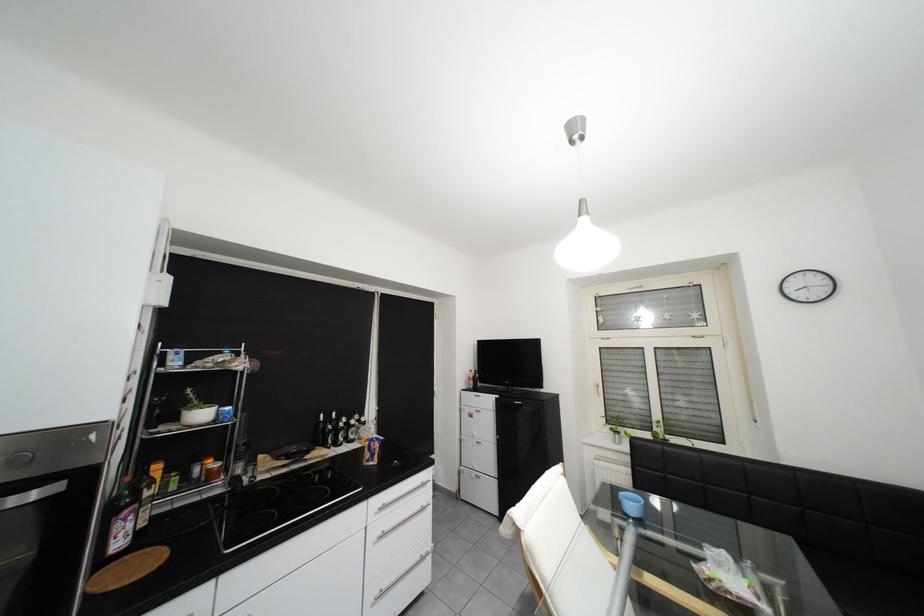
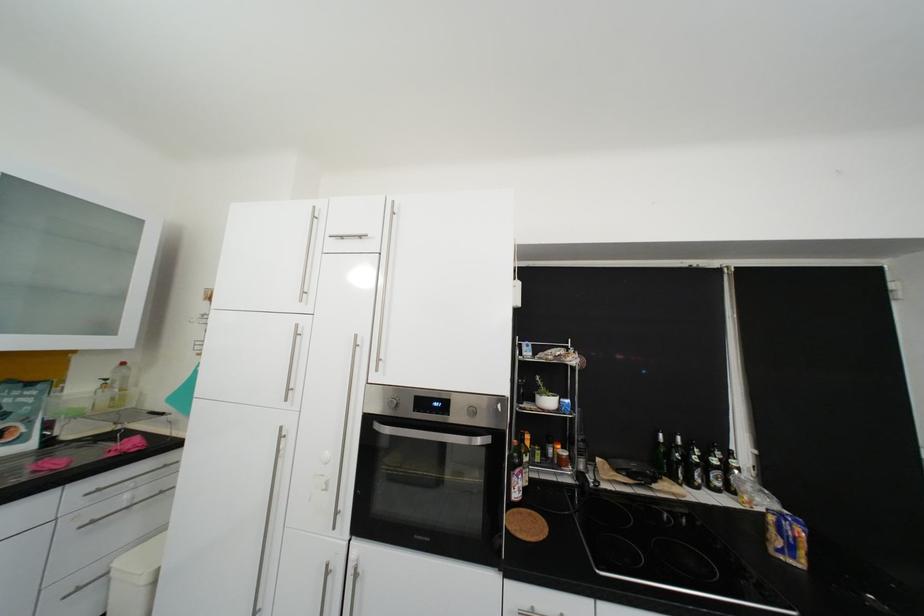
Question: The camera is either moving clockwise (left) or counter-clockwise (right) around the object. The first image is from the beginning of the video and the second image is from the end. Is the camera moving left or right when shooting the video?

Choices:
 (A) Left
 (B) Right

Answer: (B)